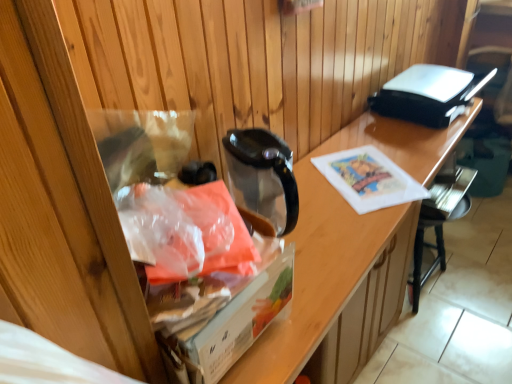
Question: Does black plastic chair at lower right have a larger size compared to translucent plastic bag at left?

Choices:
 (A) yes
 (B) no

Answer: (A)

Question: Can you confirm if black plastic chair at lower right is smaller than translucent plastic bag at left?

Choices:
 (A) yes
 (B) no

Answer: (B)

Question: Is black plastic chair at lower right taller than translucent plastic bag at left?

Choices:
 (A) yes
 (B) no

Answer: (A)

Question: From a real-world perspective, is black plastic chair at lower right under translucent plastic bag at left?

Choices:
 (A) no
 (B) yes

Answer: (B)

Question: Is black plastic chair at lower right oriented towards translucent plastic bag at left?

Choices:
 (A) no
 (B) yes

Answer: (A)

Question: In terms of size, does black plastic toaster at upper right appear bigger or smaller than transparent plastic bag at left?

Choices:
 (A) small
 (B) big

Answer: (A)

Question: Considering the positions of point (490, 72) and point (289, 349), is point (490, 72) closer or farther from the camera than point (289, 349)?

Choices:
 (A) farther
 (B) closer

Answer: (A)

Question: Would you say black plastic toaster at upper right is inside or outside transparent plastic bag at left?

Choices:
 (A) outside
 (B) inside

Answer: (A)

Question: From a real-world perspective, relative to transparent plastic bag at left, is black plastic toaster at upper right vertically above or below?

Choices:
 (A) below
 (B) above

Answer: (B)

Question: Considering the positions of translucent plastic bag at left and black plastic toaster at upper right in the image, is translucent plastic bag at left bigger or smaller than black plastic toaster at upper right?

Choices:
 (A) small
 (B) big

Answer: (A)

Question: Which is correct: translucent plastic bag at left is inside black plastic toaster at upper right, or outside of it?

Choices:
 (A) outside
 (B) inside

Answer: (A)

Question: Relative to black plastic toaster at upper right, is translucent plastic bag at left in front or behind?

Choices:
 (A) behind
 (B) front

Answer: (B)

Question: From the image's perspective, is translucent plastic bag at left positioned above or below black plastic toaster at upper right?

Choices:
 (A) below
 (B) above

Answer: (A)

Question: Does point (417, 289) appear closer or farther from the camera than point (335, 192)?

Choices:
 (A) closer
 (B) farther

Answer: (B)

Question: From the image's perspective, is black plastic chair at lower right above or below transparent plastic bag at left?

Choices:
 (A) above
 (B) below

Answer: (A)